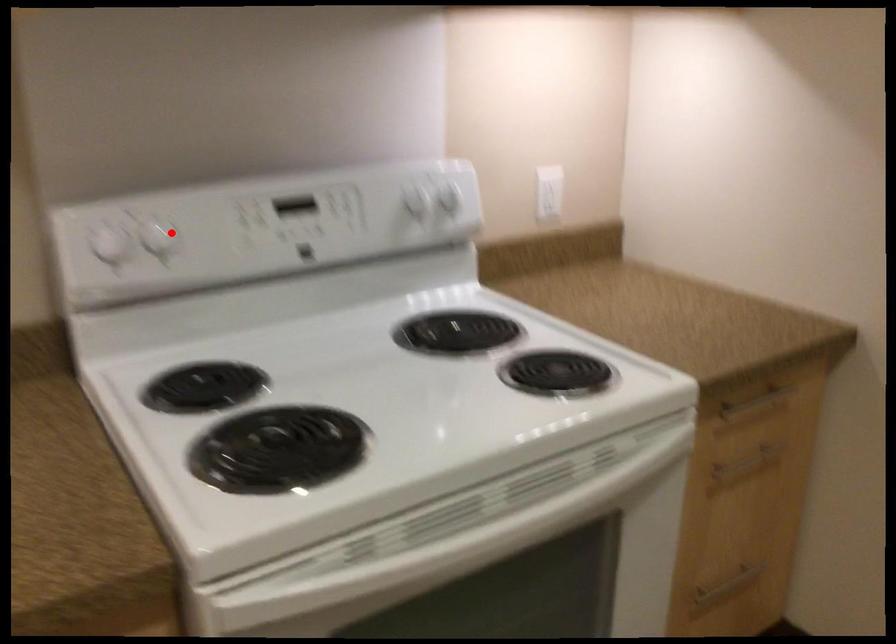
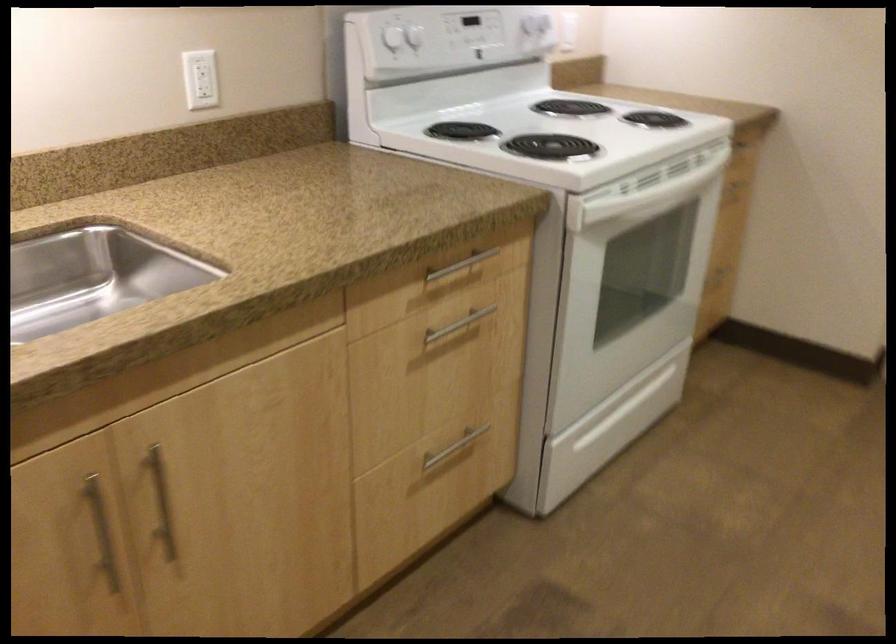
In the second image, find the point that corresponds to the highlighted location in the first image.

(414, 37)